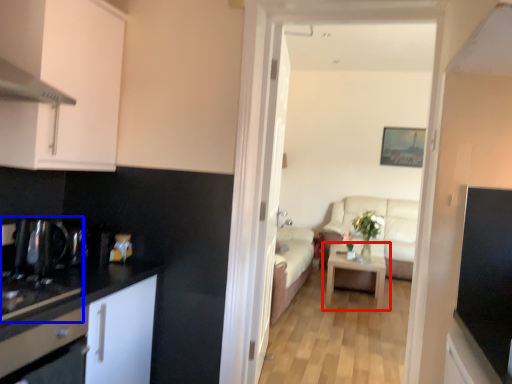
Question: Which point is closer to the camera, table (highlighted by a red box) or sink (highlighted by a blue box)?

Choices:
 (A) table
 (B) sink

Answer: (B)